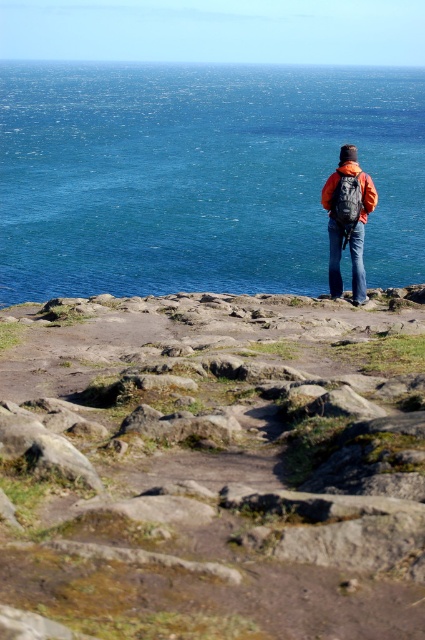
Question: Is blue water at center to the left of orange fabric backpack at center from the viewer's perspective?

Choices:
 (A) yes
 (B) no

Answer: (B)

Question: Which is farther from the orange fabric backpack at center?

Choices:
 (A) matte orange jacket at center
 (B) rough stone path at center

Answer: (B)

Question: Which object is the closest to the matte orange jacket at center?

Choices:
 (A) orange fabric backpack at center
 (B) blue water at center
 (C) rough stone path at center

Answer: (A)

Question: Considering the relative positions of orange fabric backpack at center and matte orange jacket at center in the image provided, where is orange fabric backpack at center located with respect to matte orange jacket at center?

Choices:
 (A) above
 (B) below

Answer: (B)

Question: Which point appears closest to the camera in this image?

Choices:
 (A) (357, 292)
 (B) (337, 177)

Answer: (B)

Question: Can you confirm if rough stone path at center is positioned above blue water at center?

Choices:
 (A) yes
 (B) no

Answer: (B)